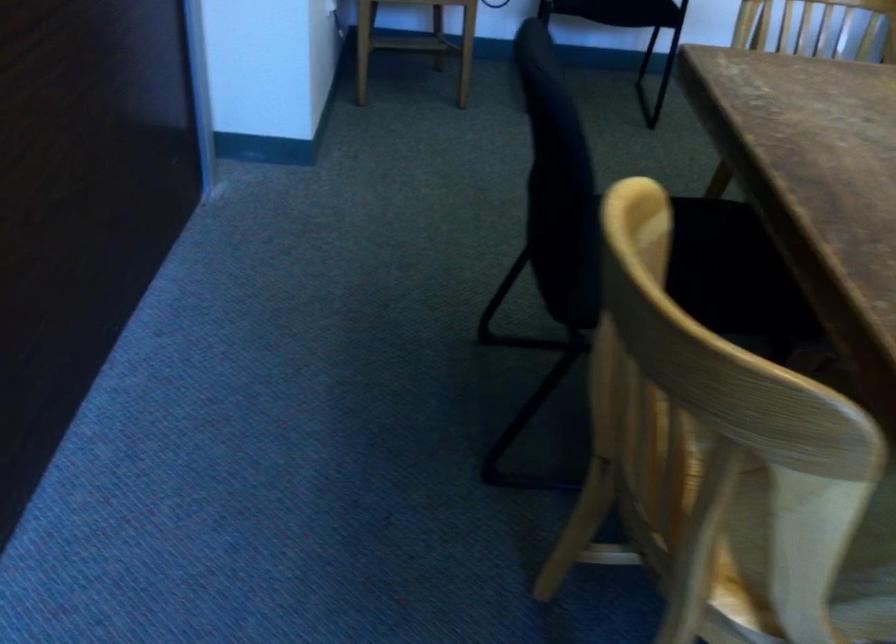
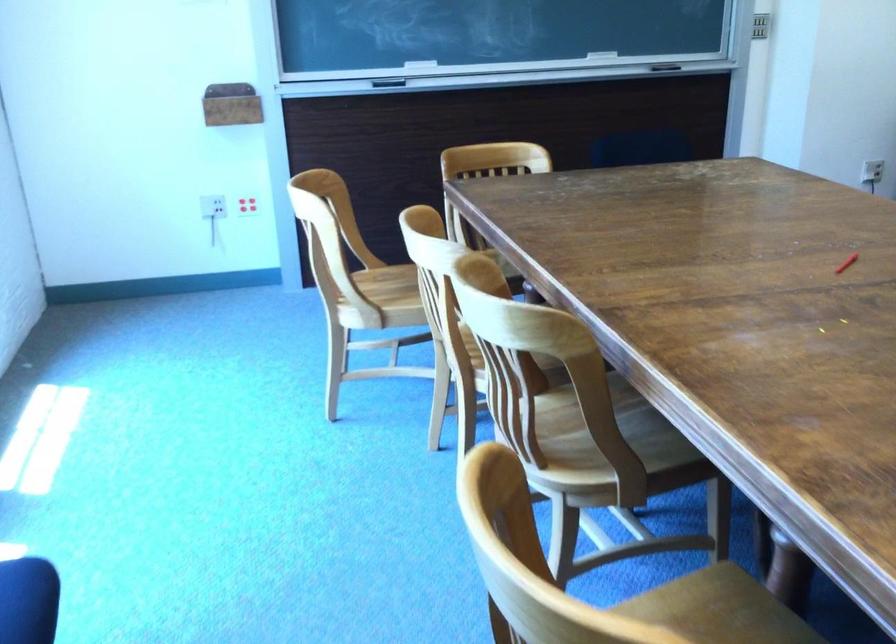
Question: I am providing you with two images of the same scene from different viewpoints. After the viewpoint changes to image2, which objects are now occluded?

Choices:
 (A) red crayon
 (B) black chair sitting surface
 (C) red utility knife
 (D) light wood chair sitting surface

Answer: (B)